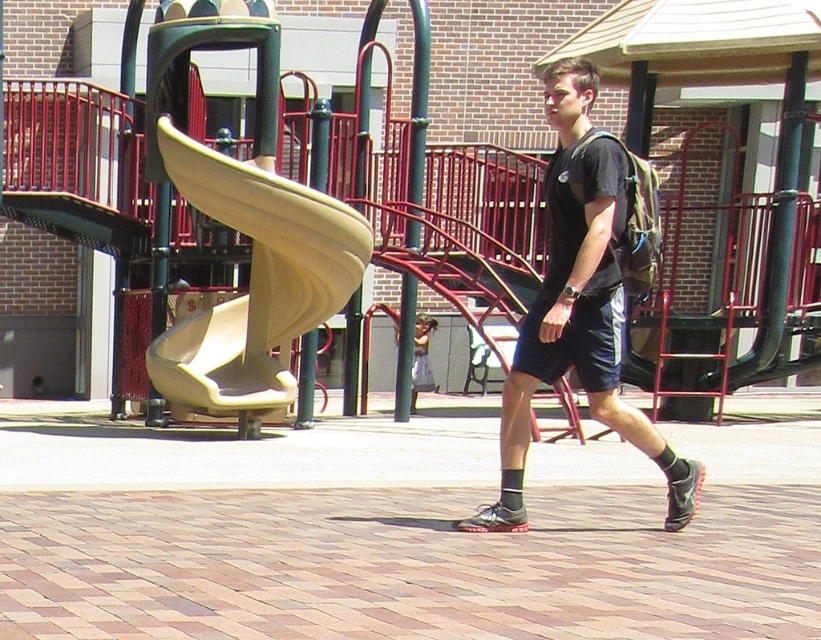
Between matte black t-shirt at center and tan rubber slide at left, which one is positioned higher?

tan rubber slide at left is higher up.

Is matte black t-shirt at center further to the viewer compared to tan rubber slide at left?

No.

Is point (617, 381) closer to viewer compared to point (264, 268)?

Yes, point (617, 381) is closer to viewer.

Identify the location of matte black t-shirt at center. (579, 305).